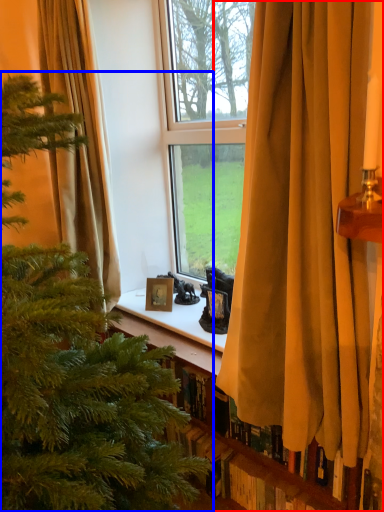
Question: Which of the following is the farthest to the observer, curtain (highlighted by a red box) or christmas tree (highlighted by a blue box)?

Choices:
 (A) curtain
 (B) christmas tree

Answer: (A)